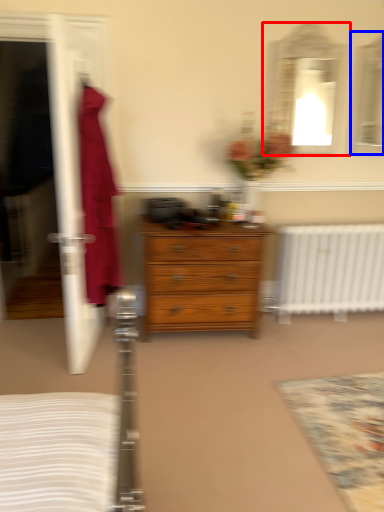
Question: Which object is further to the camera taking this photo, mirror (highlighted by a red box) or mirror (highlighted by a blue box)?

Choices:
 (A) mirror
 (B) mirror

Answer: (B)